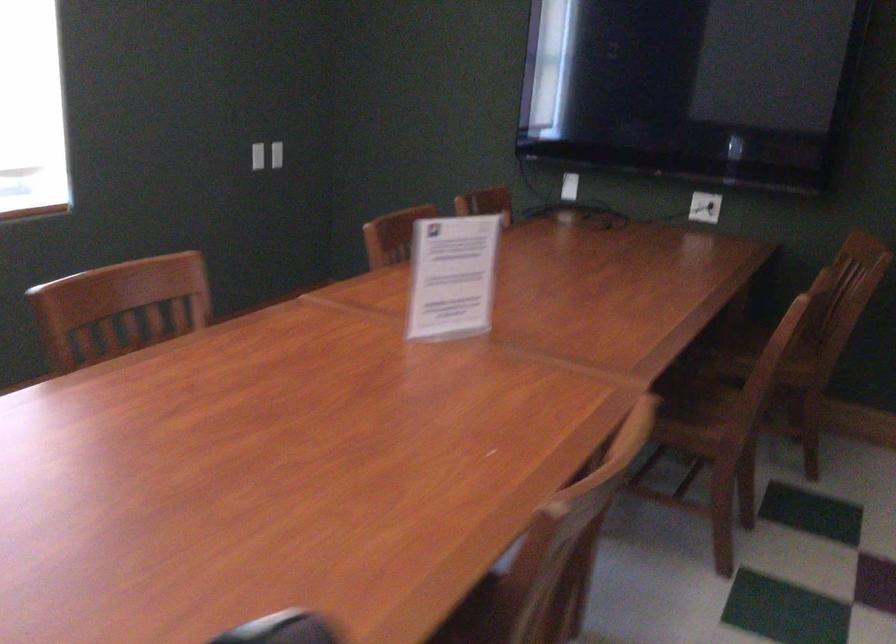
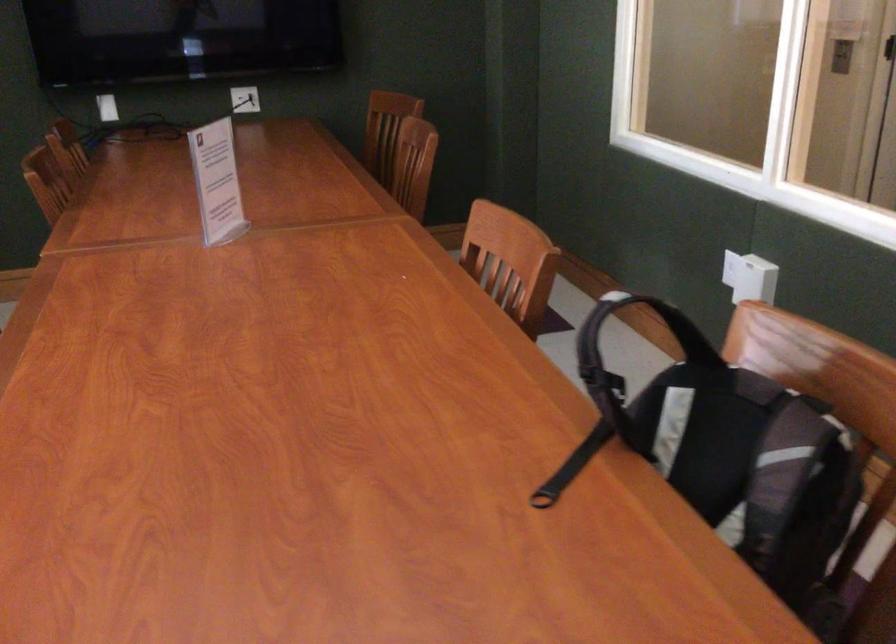
The point at (444, 278) is marked in the first image. Where is the corresponding point in the second image?

(217, 182)